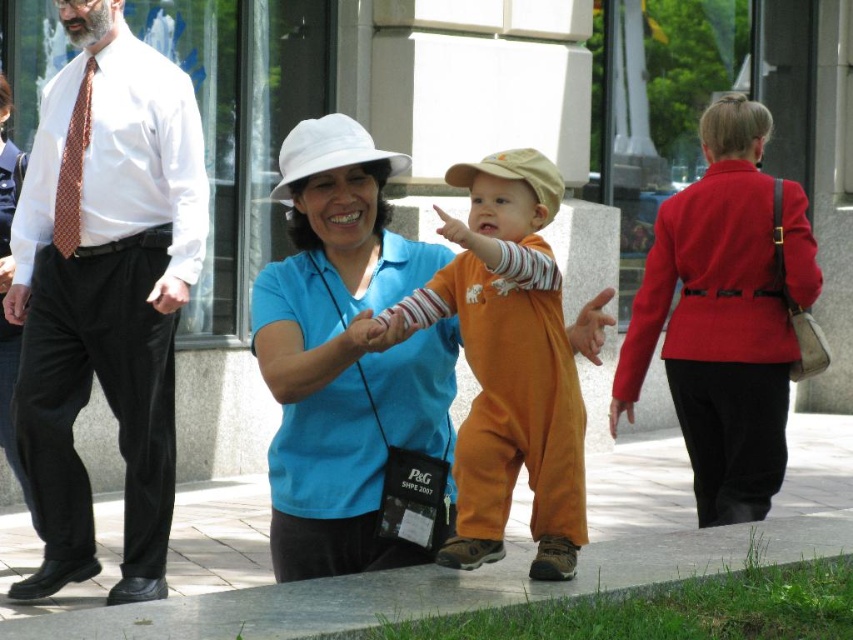
Question: Does matte orange jumpsuit at center appear under red dotted tie at left?

Choices:
 (A) yes
 (B) no

Answer: (A)

Question: Can you confirm if matte orange jumpsuit at center is positioned to the left of red dotted tie at left?

Choices:
 (A) no
 (B) yes

Answer: (A)

Question: Estimate the real-world distances between objects in this image. Which object is closer to the matte orange jumpsuit at center?

Choices:
 (A) matte brown tie at left
 (B) red dotted tie at left
 (C) orange cotton jumpsuit at center

Answer: (A)

Question: Is matte brown tie at left to the right of blue cotton shirt at center from the viewer's perspective?

Choices:
 (A) no
 (B) yes

Answer: (A)

Question: Which object is positioned farthest from the red dotted tie at left?

Choices:
 (A) paved stone sidewalk at center
 (B) orange cotton jumpsuit at center
 (C) blue cotton shirt at center
 (D) matte orange jumpsuit at center

Answer: (B)

Question: Which object is positioned closest to the paved stone sidewalk at center?

Choices:
 (A) blue cotton shirt at center
 (B) red dotted tie at left

Answer: (A)